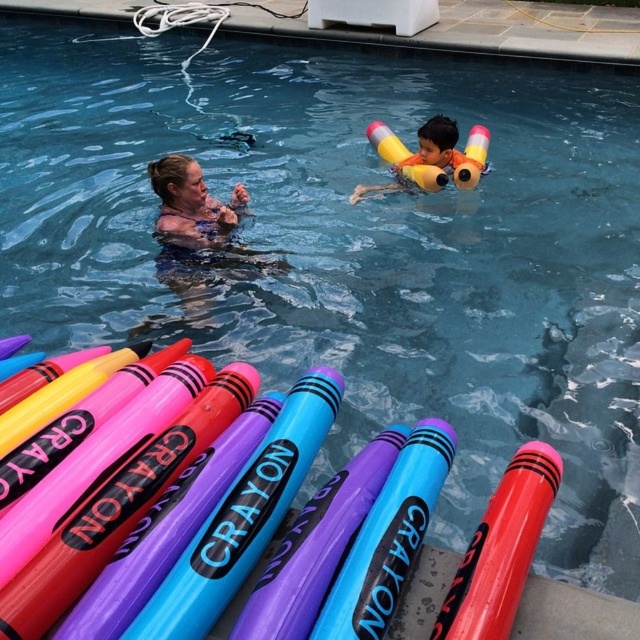
You are a photographer at the edge of the pool. You want to take a photo of the yellow foam floaties at upper center and the matte skin at center so that the floaties appear to the left of the person. Is the current arrangement suitable?

The yellow foam floaties at upper center is positioned on the right side of matte skin at center, so the floaties are currently on the right. To have them appear on the left, the photographer would need to adjust their position or the subject.

You are standing at the edge of the swimming pool and see the yellow foam floaties at upper center. If you want to reach them, in which direction should you move relative to your current position?

The yellow foam floaties at upper center are located at point coordinates, so you should move towards the center of the pool to reach them.